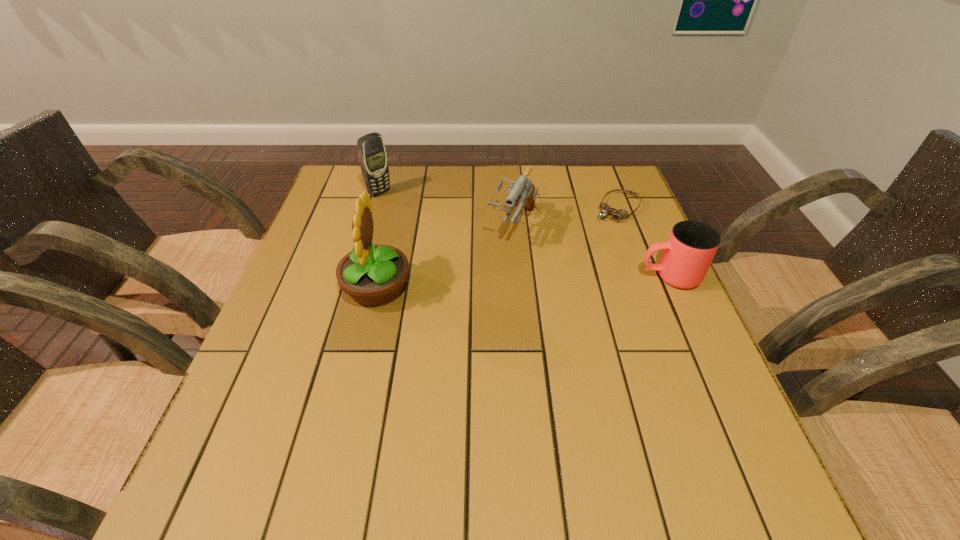
What are the coordinates of `blank area in the image that satisfies the following two spatial constraints: 1. on the front side of the third object from left to right; 2. on the handle side of the fourth tallest object` in the screenshot? It's located at (519, 276).

The height and width of the screenshot is (540, 960). In order to click on free location that satisfies the following two spatial constraints: 1. on the front side of the cellular telephone; 2. on the right side of the third shortest object in this screenshot , I will do `click(370, 226)`.